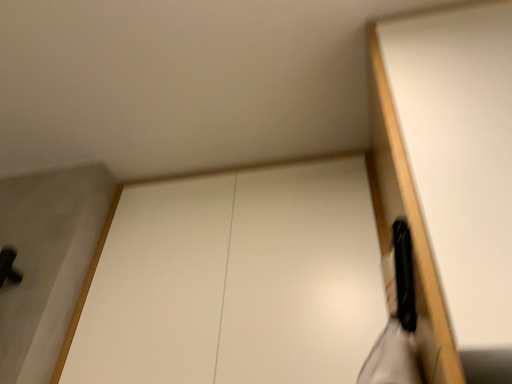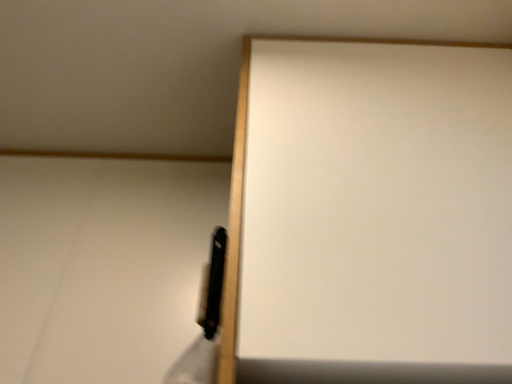
Question: How did the camera likely rotate when shooting the video?

Choices:
 (A) rotated right
 (B) rotated left

Answer: (A)